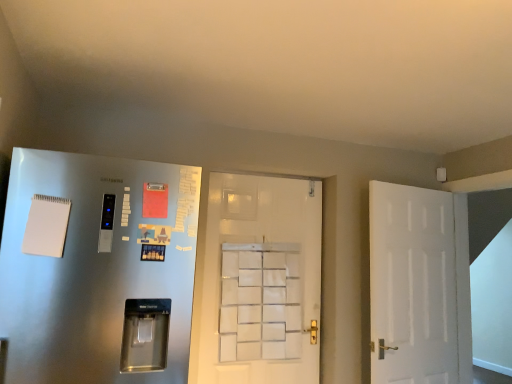
Question: From the image's perspective, is white matte door at center, which is counted as the 2th door, starting from the left, on white matte door at right, the 3th door when ordered from left to right?

Choices:
 (A) yes
 (B) no

Answer: (A)

Question: Does white matte door at center, marked as the second door in a right-to-left arrangement, turn towards white matte door at right, marked as the 1th door in a right-to-left arrangement?

Choices:
 (A) no
 (B) yes

Answer: (A)

Question: Considering the relative positions of white matte door at center, which is counted as the 2th door, starting from the left, and white matte door at right, marked as the 1th door in a right-to-left arrangement, in the image provided, is white matte door at center, which is counted as the 2th door, starting from the left, to the left of white matte door at right, marked as the 1th door in a right-to-left arrangement, from the viewer's perspective?

Choices:
 (A) yes
 (B) no

Answer: (A)

Question: Is white matte door at center, marked as the second door in a right-to-left arrangement, smaller than white matte door at right, marked as the 1th door in a right-to-left arrangement?

Choices:
 (A) no
 (B) yes

Answer: (B)

Question: Is white matte door at right, marked as the 1th door in a right-to-left arrangement, completely or partially inside white matte door at center, marked as the second door in a right-to-left arrangement?

Choices:
 (A) no
 (B) yes

Answer: (A)

Question: Is satin silver refrigerator at left, which ranks as the third door in right-to-left order, situated inside white matte door at center, which is counted as the 2th door, starting from the left, or outside?

Choices:
 (A) outside
 (B) inside

Answer: (A)

Question: Is satin silver refrigerator at left, arranged as the first door when viewed from the left, to the left or to the right of white matte door at center, which is counted as the 2th door, starting from the left, in the image?

Choices:
 (A) left
 (B) right

Answer: (A)

Question: In terms of size, does satin silver refrigerator at left, arranged as the first door when viewed from the left, appear bigger or smaller than white matte door at center, which is counted as the 2th door, starting from the left?

Choices:
 (A) big
 (B) small

Answer: (A)

Question: In the image, is satin silver refrigerator at left, arranged as the first door when viewed from the left, positioned in front of or behind white matte door at center, marked as the second door in a right-to-left arrangement?

Choices:
 (A) behind
 (B) front

Answer: (B)

Question: Considering the relative positions of white matte door at right, the 3th door when ordered from left to right, and white matte door at center, which is counted as the 2th door, starting from the left, in the image provided, is white matte door at right, the 3th door when ordered from left to right, to the left or to the right of white matte door at center, which is counted as the 2th door, starting from the left,?

Choices:
 (A) right
 (B) left

Answer: (A)

Question: Based on their sizes in the image, would you say white matte door at right, marked as the 1th door in a right-to-left arrangement, is bigger or smaller than white matte door at center, marked as the second door in a right-to-left arrangement?

Choices:
 (A) big
 (B) small

Answer: (A)

Question: From the image's perspective, is white matte door at right, marked as the 1th door in a right-to-left arrangement, positioned above or below white matte door at center, marked as the second door in a right-to-left arrangement?

Choices:
 (A) above
 (B) below

Answer: (B)

Question: From a real-world perspective, relative to white matte door at center, marked as the second door in a right-to-left arrangement, is white matte door at right, marked as the 1th door in a right-to-left arrangement, vertically above or below?

Choices:
 (A) above
 (B) below

Answer: (B)

Question: In the image, is satin silver refrigerator at left, arranged as the first door when viewed from the left, positioned in front of or behind white matte door at right, marked as the 1th door in a right-to-left arrangement?

Choices:
 (A) front
 (B) behind

Answer: (A)

Question: Is point (144, 173) closer or farther from the camera than point (391, 228)?

Choices:
 (A) closer
 (B) farther

Answer: (A)